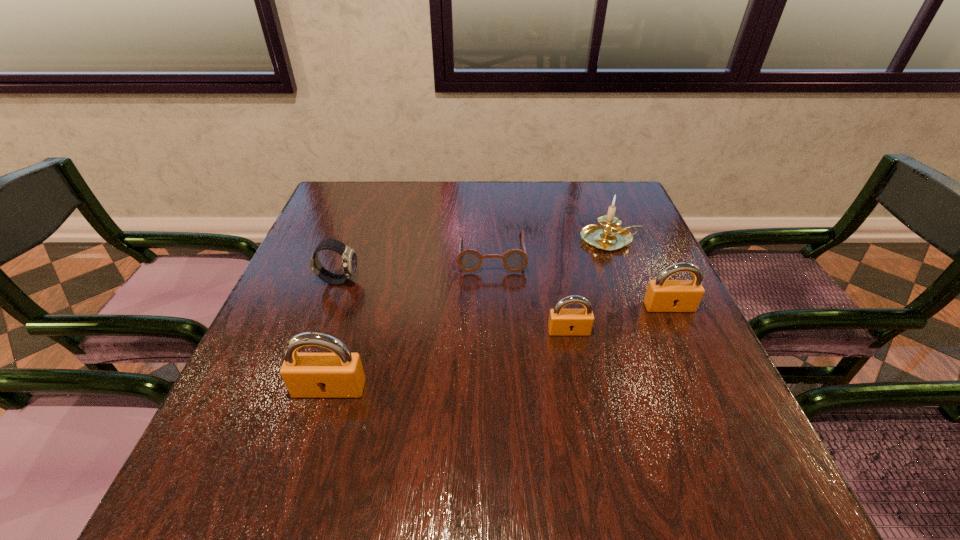
At what (x,y) coordinates should I click in order to perform the action: click on free space between the second shortest padlock and the watch. Please return your answer as a coordinate pair (x, y). The width and height of the screenshot is (960, 540). Looking at the image, I should click on (504, 294).

Find the location of a particular element. The image size is (960, 540). vacant space that is in between the third object from left to right and the second padlock from right to left is located at coordinates (530, 292).

Locate an element on the screen. The height and width of the screenshot is (540, 960). free space between the nearest object and the shortest object is located at coordinates 411,321.

This screenshot has width=960, height=540. In order to click on vacant space that is in between the fourth object from right to left and the tallest padlock in this screenshot , I will do `click(411, 321)`.

Find the location of a particular element. This screenshot has width=960, height=540. free space that is in between the third object from left to right and the second farthest padlock is located at coordinates (530, 292).

Find the location of a particular element. The width and height of the screenshot is (960, 540). vacant space that is in between the candle holder and the farthest padlock is located at coordinates (639, 273).

The width and height of the screenshot is (960, 540). In order to click on object that can be found as the fifth closest to the leftmost padlock in this screenshot , I will do `click(610, 236)`.

Where is `object that is the fourth closest to the candle holder`? The width and height of the screenshot is (960, 540). object that is the fourth closest to the candle holder is located at coordinates (349, 259).

Identify the location of the closest padlock to the second nearest object. The image size is (960, 540). (662, 295).

Locate an element on the screen. The image size is (960, 540). the closest padlock to the watch is located at coordinates (340, 374).